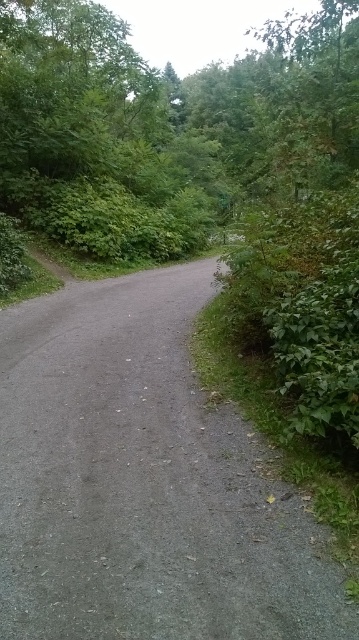
You are a hiker standing on the gray gravel road at center. You want to reach the green leafy tree at center. Which direction should you move to get closer to the tree?

The gray gravel road at center is closer to the viewer than the green leafy tree at center, so you should move forward along the path to get closer to the green leafy tree at center.

You are standing at the point marked as point (207,584) in the image. If you want to walk straight ahead along the path, how far will you have to walk before you can see the start of the path again?

You will have to walk 1.24 meters forward before you can see the start of the path again because the point and viewer are 1.24 meters apart.